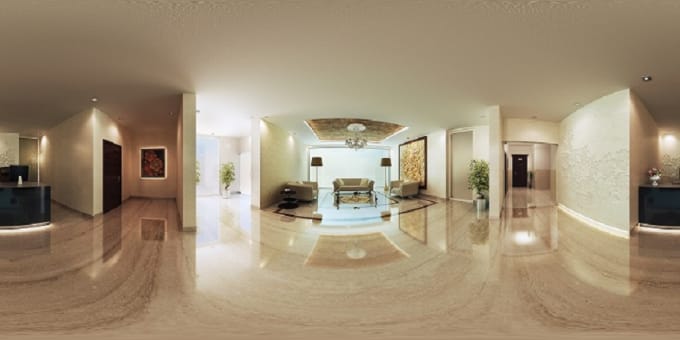
Where is `hallway in between left and middle room`? hallway in between left and middle room is located at coordinates (217, 203).